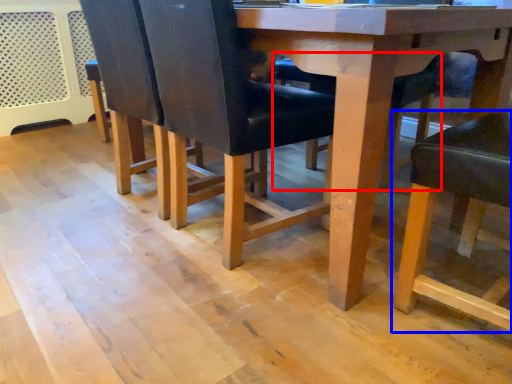
Question: Which point is closer to the camera, chair (highlighted by a red box) or chair (highlighted by a blue box)?

Choices:
 (A) chair
 (B) chair

Answer: (B)